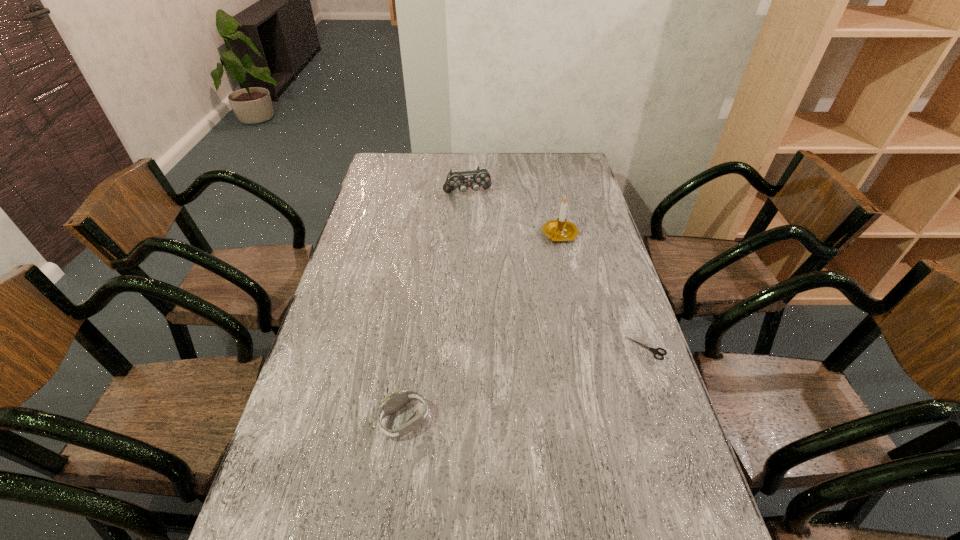
Locate an element on the screen. This screenshot has width=960, height=540. vacant space that's between the third farthest object and the nearest object is located at coordinates (526, 384).

The width and height of the screenshot is (960, 540). Find the location of `vacant area between the shears and the nearest object`. vacant area between the shears and the nearest object is located at coordinates (526, 384).

Find the location of a particular element. Image resolution: width=960 pixels, height=540 pixels. empty space that is in between the farthest object and the shortest object is located at coordinates (557, 271).

Select which object is the closest to the shears. Please provide its 2D coordinates. Your answer should be formatted as a tuple, i.e. [(x, y)], where the tuple contains the x and y coordinates of a point satisfying the conditions above.

[(556, 230)]

Locate which object is the second closest to the second farthest object. Please provide its 2D coordinates. Your answer should be formatted as a tuple, i.e. [(x, y)], where the tuple contains the x and y coordinates of a point satisfying the conditions above.

[(655, 350)]

The image size is (960, 540). In order to click on vacant point that satisfies the following two spatial constraints: 1. on the front side of the second tallest object; 2. on the right side of the shortest object in this screenshot , I will do `click(462, 348)`.

The width and height of the screenshot is (960, 540). I want to click on free point that satisfies the following two spatial constraints: 1. on the front side of the farthest object; 2. on the left side of the shortest object, so click(x=462, y=348).

The width and height of the screenshot is (960, 540). Identify the location of free space in the image that satisfies the following two spatial constraints: 1. on the front side of the farthest object; 2. on the right side of the second object from right to left. (466, 235).